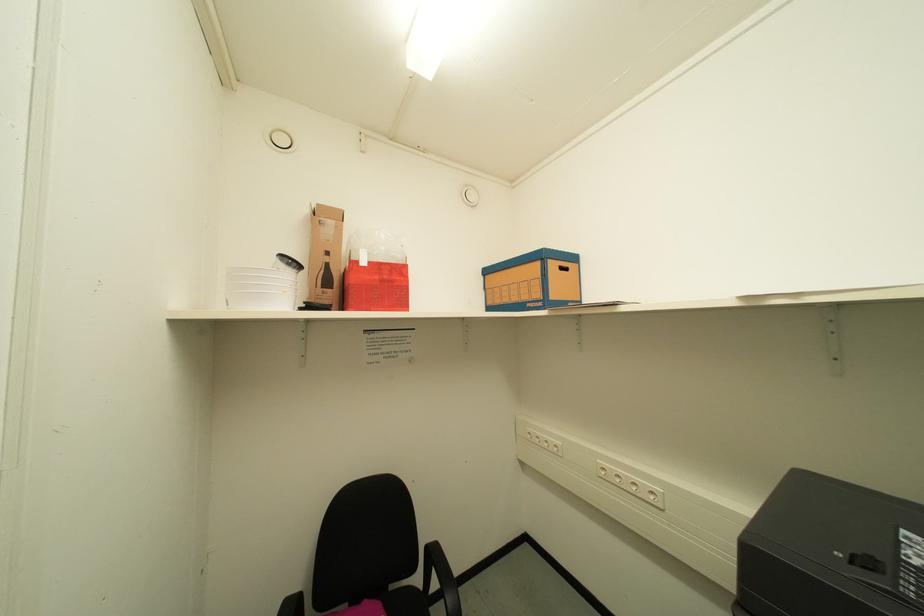
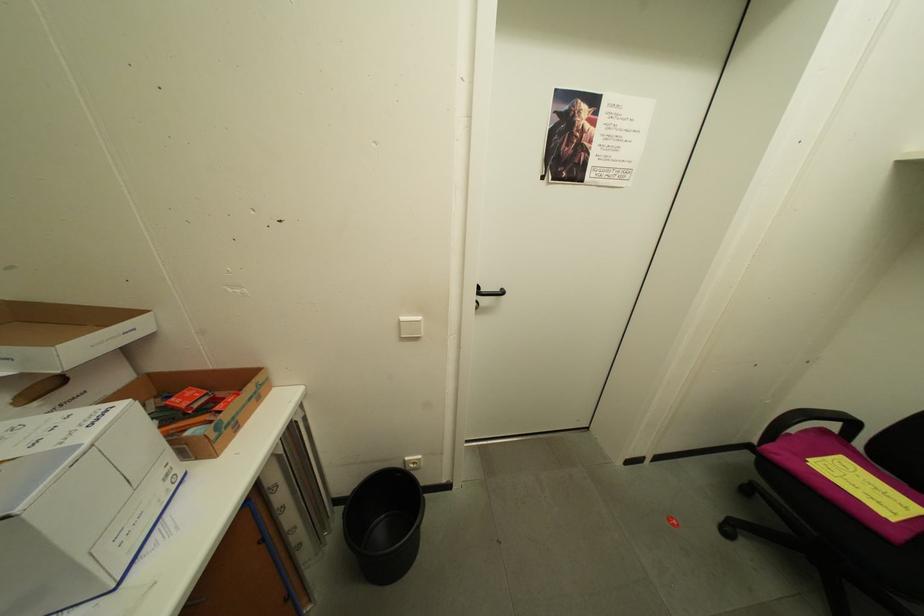
The images are taken continuously from a first-person perspective. In which direction is your viewpoint rotating?

The rotation direction of the camera is left-down.